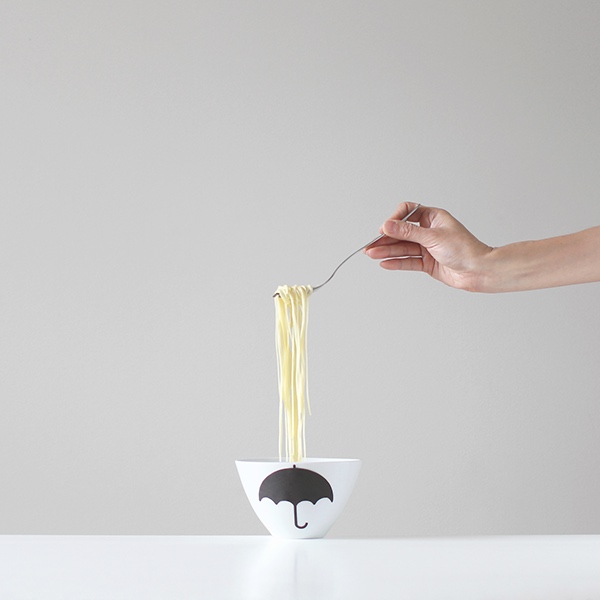
This screenshot has height=600, width=600. Find the location of `white bowl`. white bowl is located at coordinates (337, 469).